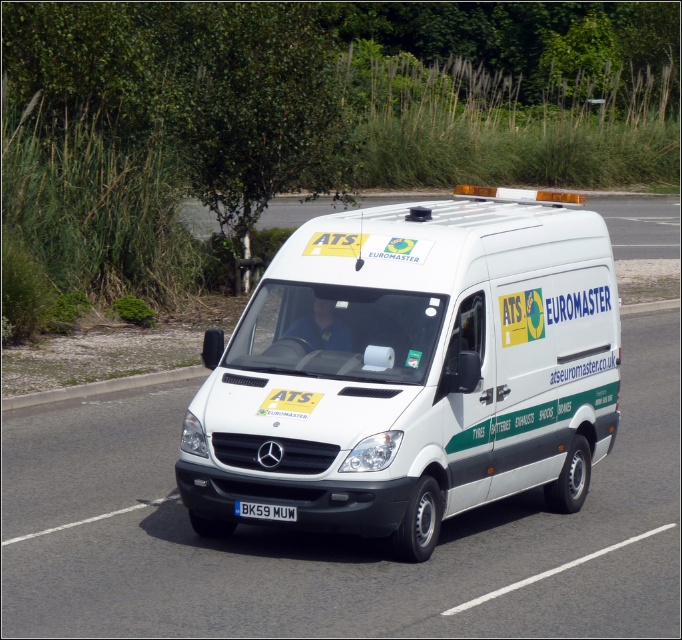
You are a delivery driver who needs to park your white matte van at center under a low clearance bridge. The bridge has a height restriction of 2 meters. Knowing that the black plastic license plate at lower center is 15 cm in height, can you estimate whether your van will fit under the bridge?

The white matte van at center is taller than the black plastic license plate at lower center, which is 15 cm in height. Since the van is taller than the license plate, but the exact height of the van isn

You are a pedestrian standing on the sidewalk. You see the white matte van at center and the black plastic license plate at lower center. Which object is higher in the image?

The white matte van at center is higher than the black plastic license plate at lower center.

Consider the image. You are a delivery driver who needs to park your white matte van at center in a parking spot that is 5.5 meters long. The van is 5.2 meters long. Can the van fit in the parking spot?

The white matte van at center is 5.2 meters long, which is shorter than the 5.5 meters parking spot. Therefore, the van can fit in the parking spot.